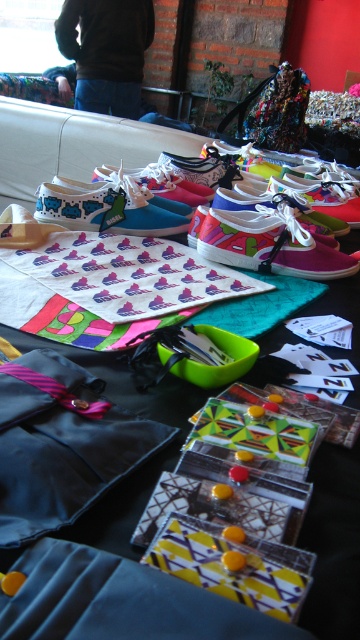
Question: Which of the following is the closest to the observer?

Choices:
 (A) (146, 312)
 (B) (48, 378)
 (C) (147, 173)
 (D) (208, 237)

Answer: (B)

Question: Estimate the real-world distances between objects in this image. Which object is closer to the matte fabric mat at center?

Choices:
 (A) matte pink canvas shoes at center
 (B) blue matte sneakers at center

Answer: (B)

Question: Which point is farther to the camera?

Choices:
 (A) (36, 440)
 (B) (357, 452)

Answer: (B)

Question: Where is matte fabric mat at center located in relation to matte plastic shoes at center in the image?

Choices:
 (A) below
 (B) above

Answer: (B)

Question: Is matte fabric mat at center wider than matte pink canvas sneakers at center?

Choices:
 (A) no
 (B) yes

Answer: (B)

Question: Does matte pink canvas shoes at center lie behind matte pink sneakers at center?

Choices:
 (A) no
 (B) yes

Answer: (A)